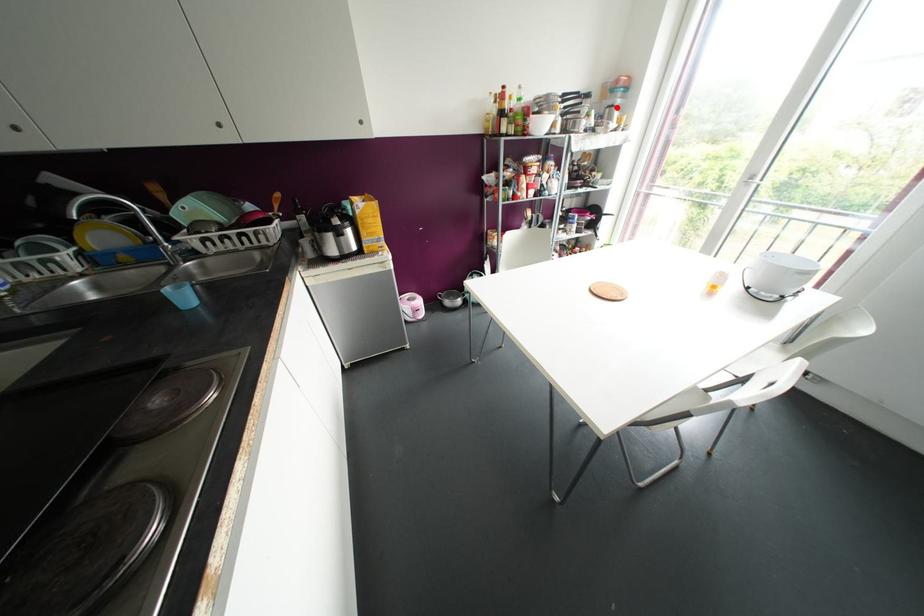
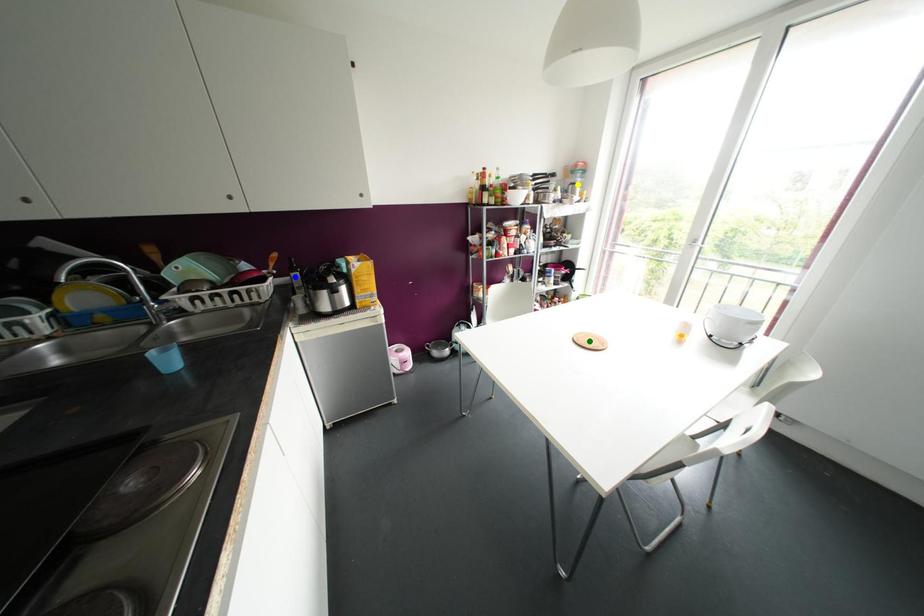
Question: I am providing you with two images of the same scene from different viewpoints. A red point is marked on the first image. You are given multiple points on the second image. Which mark in image 2 goes with the point in image 1?

Choices:
 (A) blue point
 (B) yellow point
 (C) green point

Answer: (B)